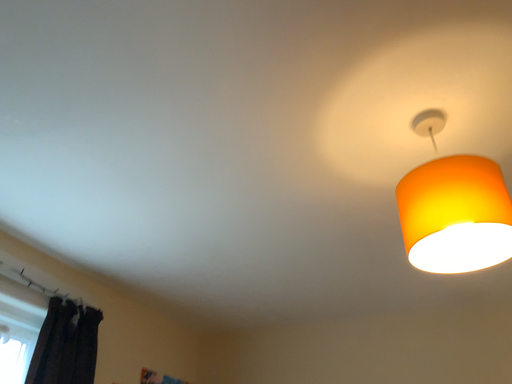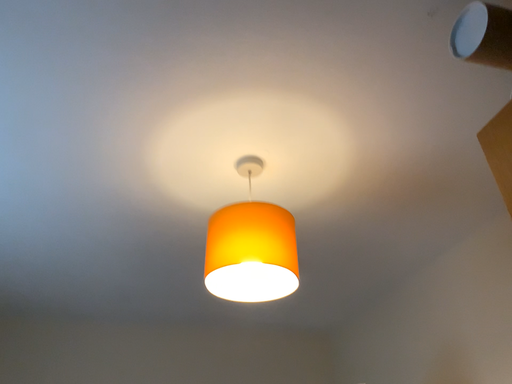
Question: How did the camera likely rotate when shooting the video?

Choices:
 (A) rotated left
 (B) rotated right

Answer: (B)